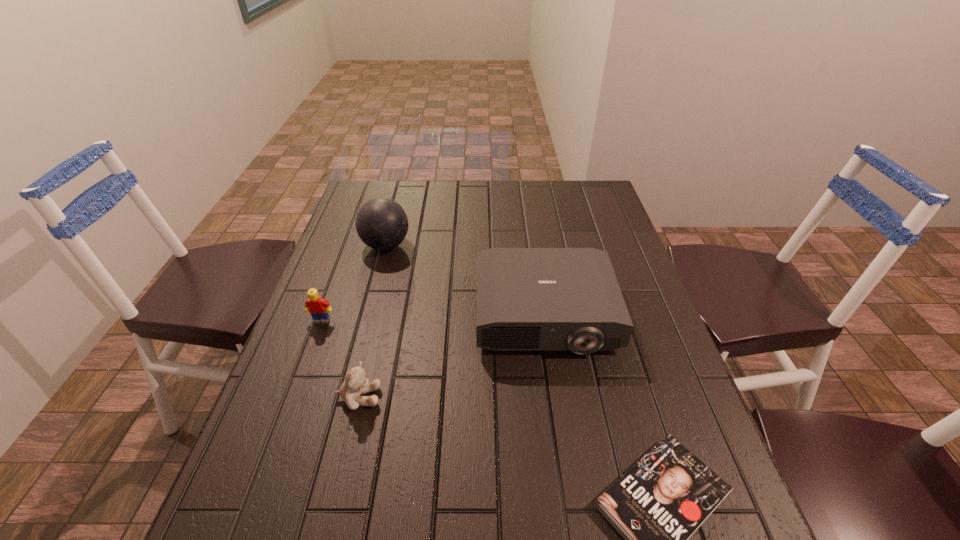
This screenshot has width=960, height=540. Identify the location of bowling ball. (382, 224).

What are the coordinates of `the tallest object` in the screenshot? It's located at (382, 224).

The width and height of the screenshot is (960, 540). Identify the location of projector. (528, 299).

Locate an element on the screen. Lego is located at coordinates (318, 307).

Locate an element on the screen. the second nearest object is located at coordinates (356, 382).

This screenshot has width=960, height=540. In order to click on vacant space located 0.150m on the grip area of the farthest object in this screenshot , I will do `click(460, 245)`.

At what (x,y) coordinates should I click in order to perform the action: click on vacant space located 0.060m on the front-facing side of the projector. Please return your answer as a coordinate pair (x, y). Looking at the image, I should click on (554, 380).

Where is `vacant space located 0.160m on the front-facing side of the leftmost object`? vacant space located 0.160m on the front-facing side of the leftmost object is located at coordinates (300, 376).

Identify the location of vacant space located on the face of the fourth farthest object. The width and height of the screenshot is (960, 540). (437, 397).

Where is `bowling ball that is at the left edge`? Image resolution: width=960 pixels, height=540 pixels. bowling ball that is at the left edge is located at coordinates (382, 224).